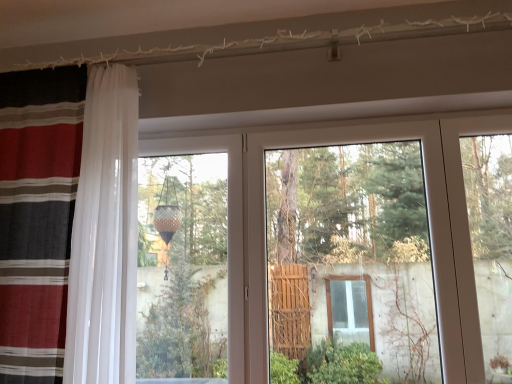
At what (x,y) coordinates should I click in order to perform the action: click on transparent glass door at center. Please return your answer as a coordinate pair (x, y). Image resolution: width=512 pixels, height=384 pixels. Looking at the image, I should click on (347, 244).

Image resolution: width=512 pixels, height=384 pixels. Describe the element at coordinates (347, 244) in the screenshot. I see `transparent glass door at center` at that location.

Measure the distance between point (348, 296) and camera.

Point (348, 296) and camera are 3.74 meters apart from each other.

The width and height of the screenshot is (512, 384). What do you see at coordinates (37, 217) in the screenshot?
I see `striped fabric curtain at left` at bounding box center [37, 217].

Measure the distance between point (18, 300) and camera.

Point (18, 300) is 5.25 feet away from camera.

This screenshot has height=384, width=512. In order to click on striped fabric curtain at left in this screenshot , I will do click(37, 217).

At what (x,y) coordinates should I click in order to perform the action: click on transparent glass door at center. Please return your answer as a coordinate pair (x, y). This screenshot has width=512, height=384. Looking at the image, I should click on (347, 244).

Between striped fabric curtain at left and transparent glass door at center, which one appears on the right side from the viewer's perspective?

transparent glass door at center.

Relative to transparent glass door at center, is striped fabric curtain at left in front or behind?

Clearly, striped fabric curtain at left is in front of transparent glass door at center.

Considering the points (51, 380) and (377, 231), which point is behind, point (51, 380) or point (377, 231)?

The point (377, 231) is farther.

From the image's perspective, is striped fabric curtain at left above or below transparent glass door at center?

Clearly, from the image's perspective, striped fabric curtain at left is above transparent glass door at center.

From a real-world perspective, is striped fabric curtain at left physically located above or below transparent glass door at center?

From a real-world perspective, striped fabric curtain at left is physically above transparent glass door at center.

Between striped fabric curtain at left and transparent glass door at center, which one has larger width?

Wider between the two is striped fabric curtain at left.

Is striped fabric curtain at left taller than transparent glass door at center?

Yes.

Looking at the image, does striped fabric curtain at left seem bigger or smaller compared to transparent glass door at center?

In the image, striped fabric curtain at left appears to be larger than transparent glass door at center.

Is transparent glass door at center completely or partially inside striped fabric curtain at left?

No, transparent glass door at center is not a part of striped fabric curtain at left.

Looking at this image, are striped fabric curtain at left and transparent glass door at center located far from each other?

striped fabric curtain at left is far away from transparent glass door at center.

Does striped fabric curtain at left turn towards transparent glass door at center?

No, striped fabric curtain at left is not oriented towards transparent glass door at center.

How far apart are striped fabric curtain at left and transparent glass door at center?

The distance of striped fabric curtain at left from transparent glass door at center is 1.45 meters.

I want to click on glass door on the right of striped fabric curtain at left, so click(x=347, y=244).

Can you confirm if transparent glass door at center is positioned to the right of striped fabric curtain at left?

Yes.

Is transparent glass door at center positioned behind striped fabric curtain at left?

Yes, it is.

Considering the positions of point (271, 253) and point (15, 268), is point (271, 253) closer or farther from the camera than point (15, 268)?

Point (271, 253) is positioned farther from the camera compared to point (15, 268).

From the image's perspective, is transparent glass door at center positioned above or below striped fabric curtain at left?

Clearly, from the image's perspective, transparent glass door at center is below striped fabric curtain at left.

From a real-world perspective, is transparent glass door at center beneath striped fabric curtain at left?

Correct, in the physical world, transparent glass door at center is lower than striped fabric curtain at left.

Which of these two, transparent glass door at center or striped fabric curtain at left, is wider?

striped fabric curtain at left is wider.

Does transparent glass door at center have a greater height compared to striped fabric curtain at left?

No, transparent glass door at center is not taller than striped fabric curtain at left.

Looking at this image, considering the relative sizes of transparent glass door at center and striped fabric curtain at left in the image provided, is transparent glass door at center bigger than striped fabric curtain at left?

Actually, transparent glass door at center might be smaller than striped fabric curtain at left.

Is transparent glass door at center inside the boundaries of striped fabric curtain at left, or outside?

transparent glass door at center is not inside striped fabric curtain at left, it's outside.

Would you consider transparent glass door at center to be distant from striped fabric curtain at left?

Absolutely, transparent glass door at center is distant from striped fabric curtain at left.

Is transparent glass door at center facing away from striped fabric curtain at left?

transparent glass door at center does not have its back to striped fabric curtain at left.

The image size is (512, 384). I want to click on curtain lying in front of the transparent glass door at center, so click(37, 217).

Where is `curtain that is above the transparent glass door at center (from the image's perspective)`? This screenshot has width=512, height=384. curtain that is above the transparent glass door at center (from the image's perspective) is located at coordinates (37, 217).

You are a GUI agent. You are given a task and a screenshot of the screen. Output one action in this format:
    pyautogui.click(x=<x>, y=<y>)
    Task: Click on the glass door below the striped fabric curtain at left (from the image's perspective)
    
    Given the screenshot: What is the action you would take?
    pyautogui.click(x=347, y=244)